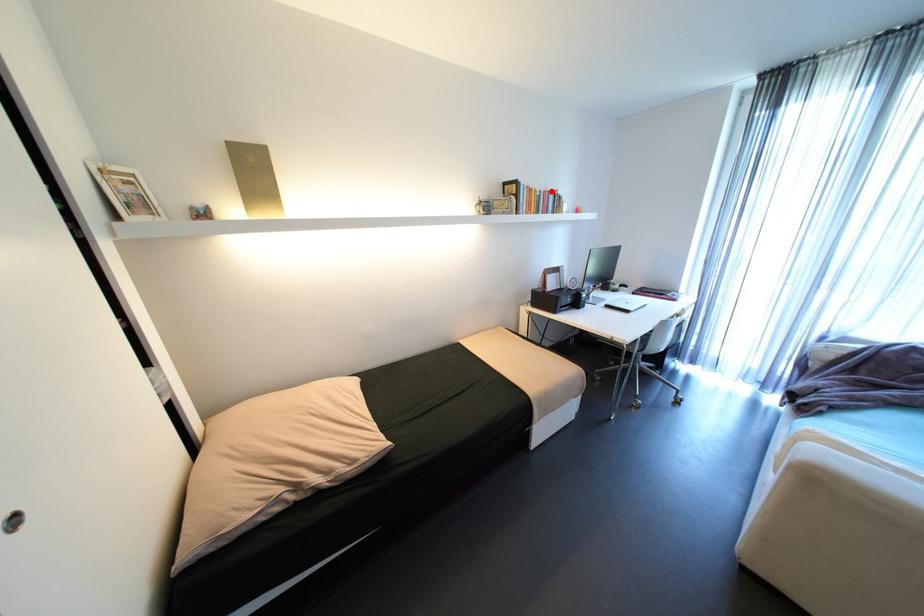
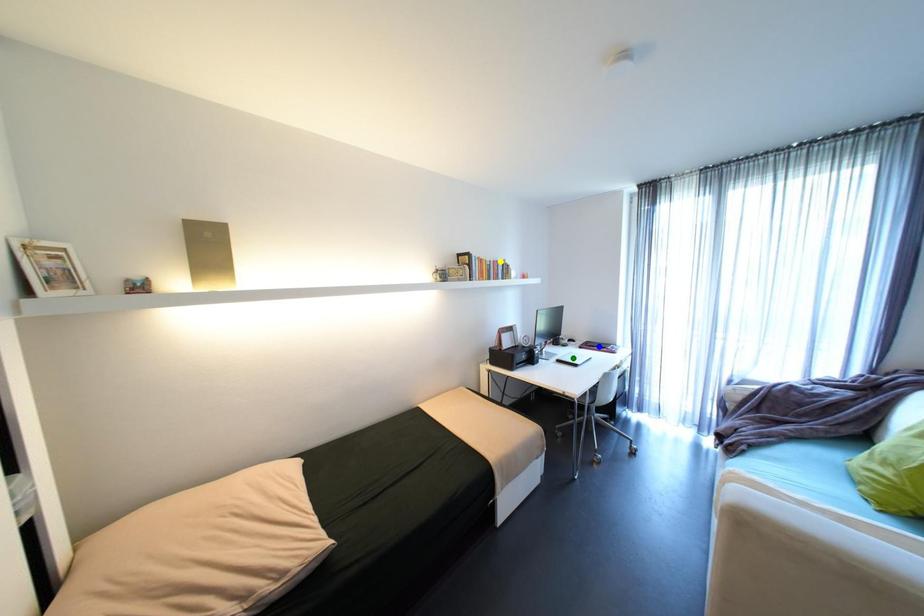
Question: I am providing you with two images of the same scene from different viewpoints. A red point is marked on the first image. You are given multiple points on the second image. In image 2, which mark is for the same physical point as the one in image 1?

Choices:
 (A) blue point
 (B) yellow point
 (C) green point

Answer: (B)